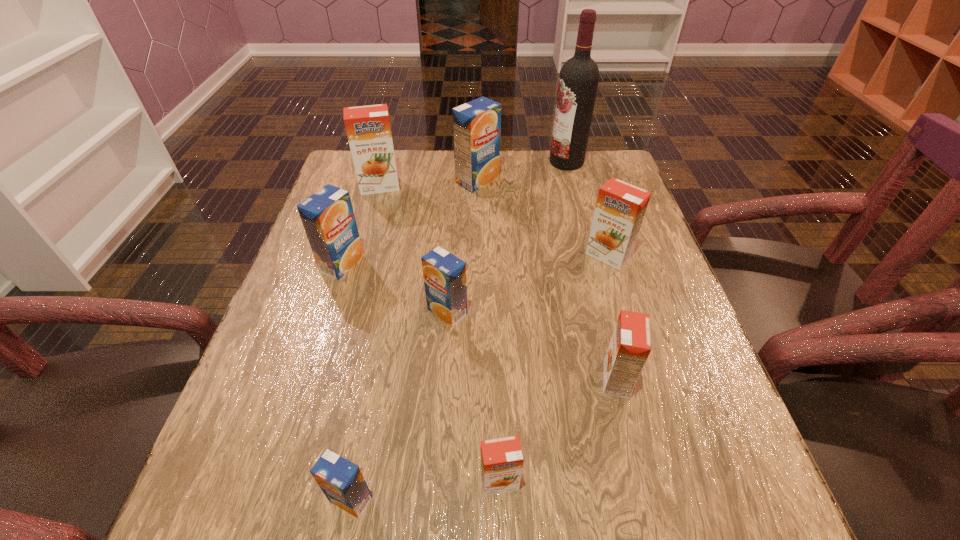
Locate an element on the screen. The image size is (960, 540). the seventh farthest object is located at coordinates (630, 345).

The image size is (960, 540). I want to click on the third blue orange_juice from right to left, so click(x=342, y=482).

This screenshot has height=540, width=960. Find the location of `the smallest blue orange_juice`. the smallest blue orange_juice is located at coordinates (342, 482).

Identify the location of the smallest orange orange juice. (501, 460).

At what (x,y) coordinates should I click in order to perform the action: click on the nearest orange orange juice. Please return your answer as a coordinate pair (x, y). The height and width of the screenshot is (540, 960). Looking at the image, I should click on (501, 460).

Find the location of a particular element. The image size is (960, 540). vacant area situated 0.400m on the label of the tallest object is located at coordinates (416, 162).

I want to click on free space located on the label of the tallest object, so click(x=513, y=162).

What are the coordinates of `vacant space located on the label of the tallest object` in the screenshot? It's located at (482, 162).

This screenshot has height=540, width=960. I want to click on free region located on the right of the farthest blue orange_juice, so coord(545,181).

Where is `free space located on the front of the biggest orange orange juice`? The image size is (960, 540). free space located on the front of the biggest orange orange juice is located at coordinates click(371, 218).